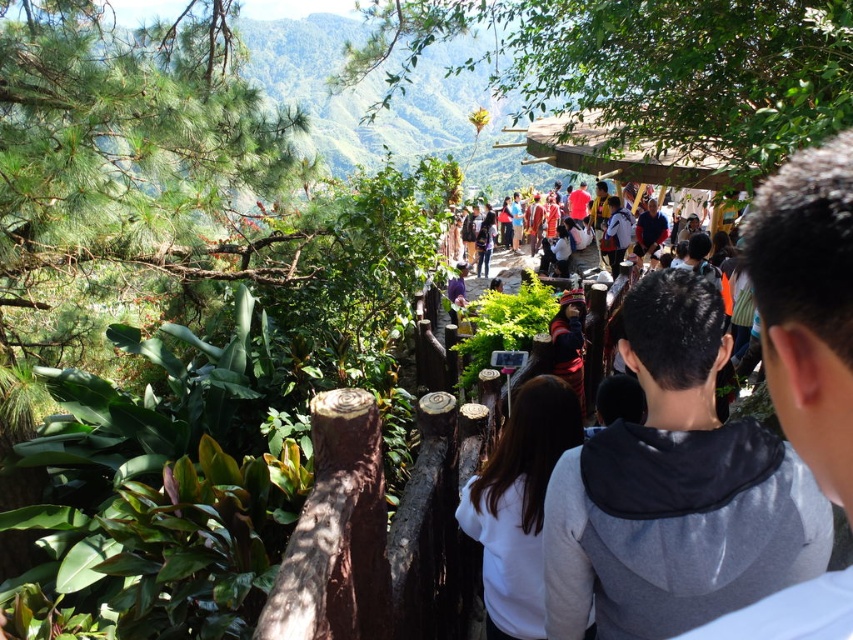
Can you confirm if reddish-brown fabric hat at center is taller than white matte sweatshirt at center?

No, reddish-brown fabric hat at center is not taller than white matte sweatshirt at center.

You are a GUI agent. You are given a task and a screenshot of the screen. Output one action in this format:
    pyautogui.click(x=<x>, y=<y>)
    Task: Click on the reddish-brown fabric hat at center
    
    Given the screenshot: What is the action you would take?
    pyautogui.click(x=675, y=490)

Locate an element on the screen. Image resolution: width=853 pixels, height=640 pixels. reddish-brown fabric hat at center is located at coordinates (675, 490).